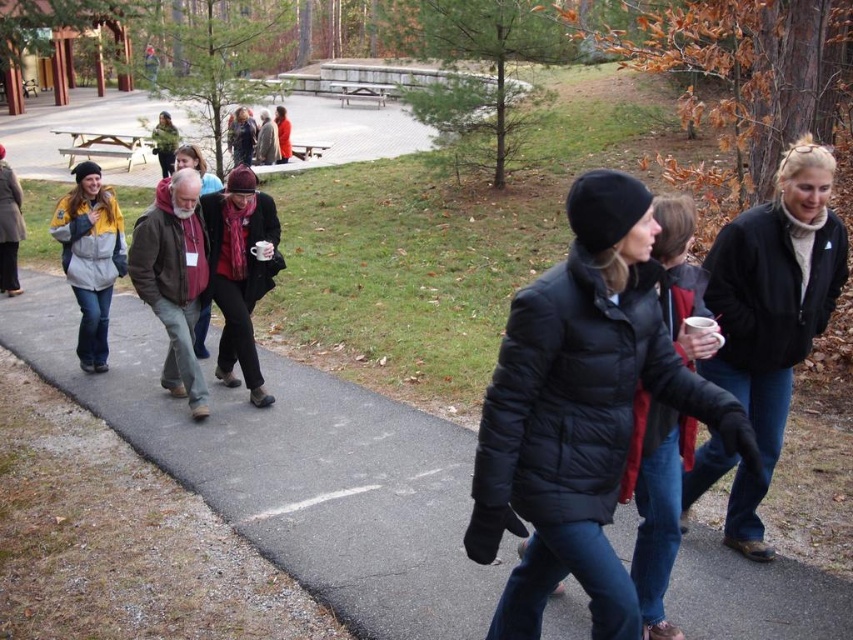
From the picture: Can you confirm if black fleece jacket at center is wider than matte red scarf at center?

Yes, black fleece jacket at center is wider than matte red scarf at center.

Is point (788, 145) positioned in front of point (239, 156)?

Yes, it is.

Between point (788, 340) and point (245, 157), which one is positioned behind?

Point (245, 157)

Image resolution: width=853 pixels, height=640 pixels. I want to click on black fleece jacket at center, so click(x=772, y=314).

Based on the photo, can you confirm if black puffy jacket at center is positioned to the left of green wool sweater at upper left?

Incorrect, black puffy jacket at center is not on the left side of green wool sweater at upper left.

Which of these two, black puffy jacket at center or green wool sweater at upper left, stands shorter?

With less height is green wool sweater at upper left.

Does point (537, 589) lie behind point (177, 138)?

That is False.

Locate an element on the screen. black puffy jacket at center is located at coordinates (581, 410).

How far apart are brown leather jacket at center and yellow and gray jacket at center?

brown leather jacket at center is 3.62 feet away from yellow and gray jacket at center.

Does point (181, 324) come closer to viewer compared to point (109, 268)?

Yes.

In order to click on brown leather jacket at center in this screenshot , I will do `click(173, 278)`.